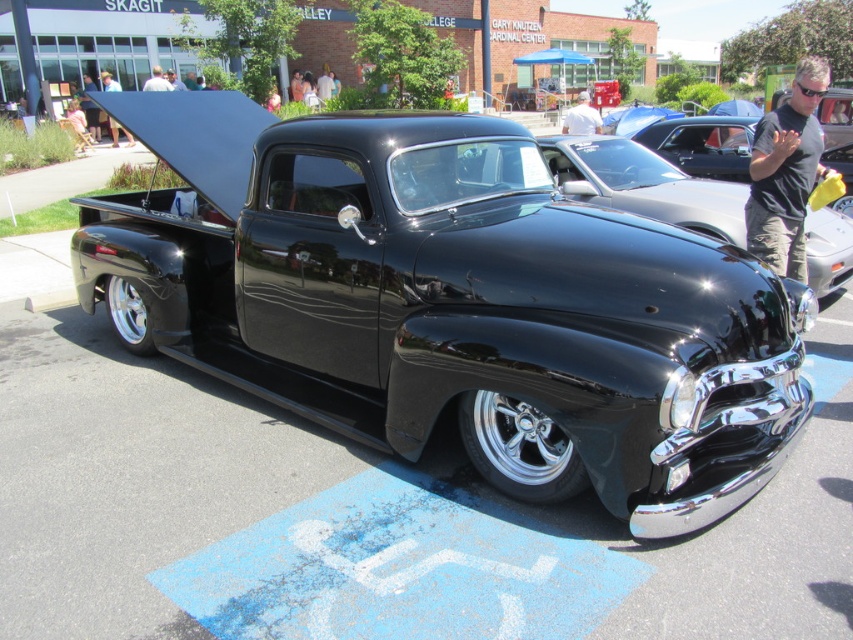
Question: Which point is farther to the camera?

Choices:
 (A) glossy black pickup truck at center
 (B) white fabric shirt at upper center
 (C) gray fabric umbrella at upper center
 (D) black t-shirt at center

Answer: (B)

Question: Based on their relative distances, which object is nearer to the gray fabric umbrella at upper center?

Choices:
 (A) white fabric shirt at upper center
 (B) glossy black pickup truck at center
 (C) black t-shirt at center

Answer: (B)

Question: Which object appears closest to the camera in this image?

Choices:
 (A) white fabric shirt at upper center
 (B) black t-shirt at center
 (C) glossy black pickup truck at center
 (D) gray fabric umbrella at upper center

Answer: (B)

Question: Is gray fabric umbrella at upper center wider than white fabric shirt at upper center?

Choices:
 (A) no
 (B) yes

Answer: (B)

Question: Observing the image, what is the correct spatial positioning of glossy black pickup truck at center in reference to gray fabric umbrella at upper center?

Choices:
 (A) below
 (B) above

Answer: (A)

Question: Does glossy black pickup truck at center have a larger size compared to black t-shirt at center?

Choices:
 (A) no
 (B) yes

Answer: (A)